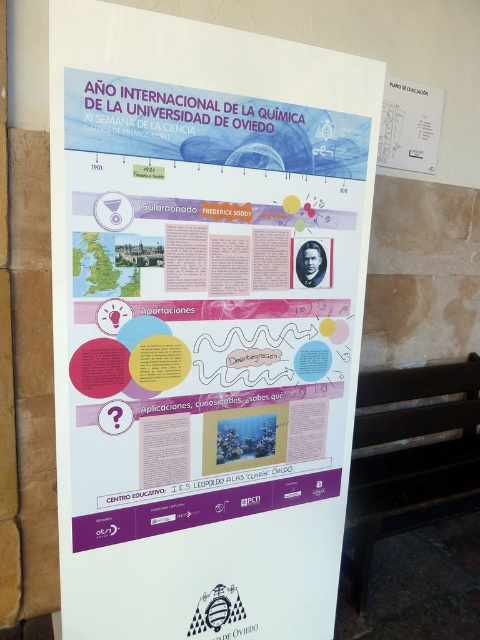
Is white paper poster at center bigger than black wood park bench at lower right?

Actually, white paper poster at center might be smaller than black wood park bench at lower right.

Is point (192, 563) positioned after point (440, 458)?

That is False.

Identify the location of white paper poster at center. The height and width of the screenshot is (640, 480). (204, 321).

This screenshot has width=480, height=640. Identify the location of white paper poster at center. (204, 321).